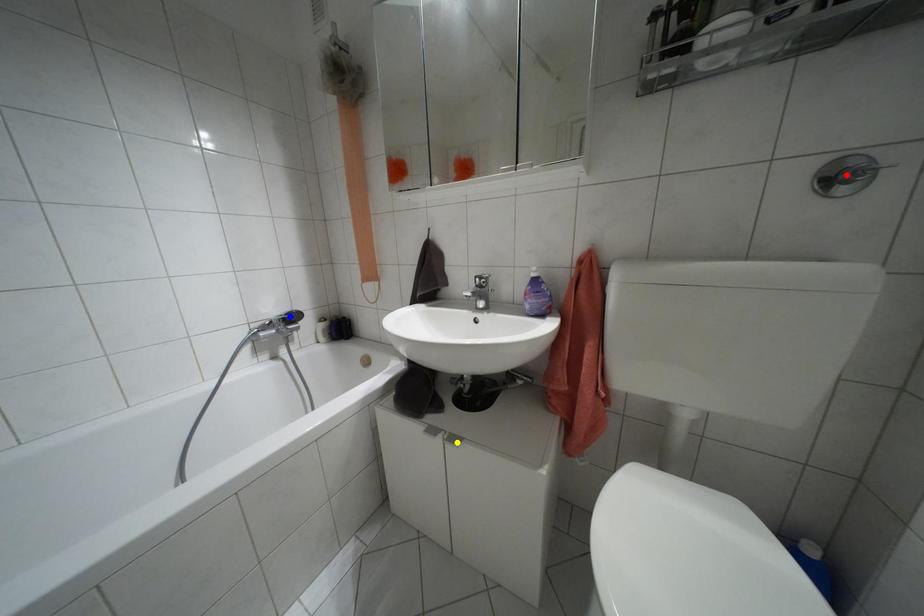
Order these from farthest to nearest:
1. blue point
2. yellow point
3. red point

blue point → yellow point → red point